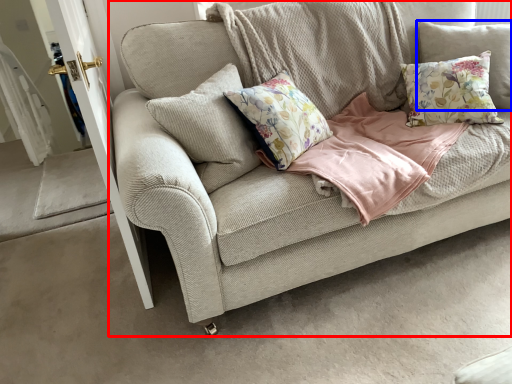
Question: Which point is further to the camera, studio couch (highlighted by a red box) or pillow (highlighted by a blue box)?

Choices:
 (A) studio couch
 (B) pillow

Answer: (B)